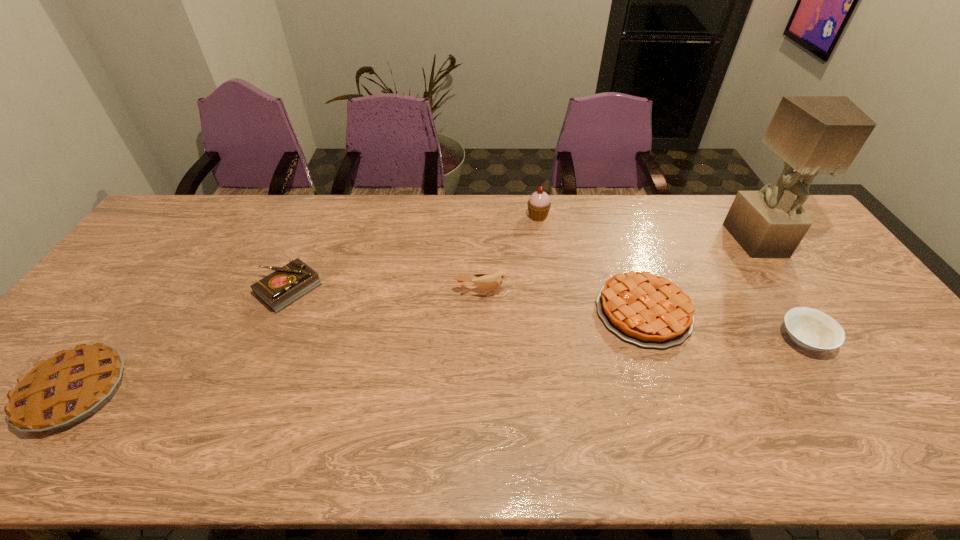
Where is `vacant space positioned on the front-facing side of the sculpture`? The image size is (960, 540). vacant space positioned on the front-facing side of the sculpture is located at coordinates point(836,353).

Where is `free spot located on the left of the farthest object`? Image resolution: width=960 pixels, height=540 pixels. free spot located on the left of the farthest object is located at coordinates (463, 217).

You are a GUI agent. You are given a task and a screenshot of the screen. Output one action in this format:
    pyautogui.click(x=<x>, y=<y>)
    Task: Click on the free space located at the beak of the fifth object from right to left
    The height and width of the screenshot is (540, 960).
    Given the screenshot: What is the action you would take?
    pyautogui.click(x=484, y=329)

At what (x,y) coordinates should I click in order to perform the action: click on free point located on the right of the bowl. Please return your answer as a coordinate pair (x, y). Looking at the image, I should click on (852, 340).

The width and height of the screenshot is (960, 540). In order to click on vacant space positioned 0.080m on the left of the diary in this screenshot , I will do `click(229, 289)`.

Where is `vacant space situated 0.110m on the back of the fifth object from left to right`? The height and width of the screenshot is (540, 960). vacant space situated 0.110m on the back of the fifth object from left to right is located at coordinates (624, 253).

Identify the location of sculpture that is positioned at the far edge. This screenshot has height=540, width=960. (813, 134).

Where is `cupcake that is at the far edge`? Image resolution: width=960 pixels, height=540 pixels. cupcake that is at the far edge is located at coordinates (539, 204).

The image size is (960, 540). I want to click on object positioned at the right edge, so click(x=813, y=134).

Find the location of a particular element. The height and width of the screenshot is (540, 960). object located in the far right corner section of the desktop is located at coordinates (813, 134).